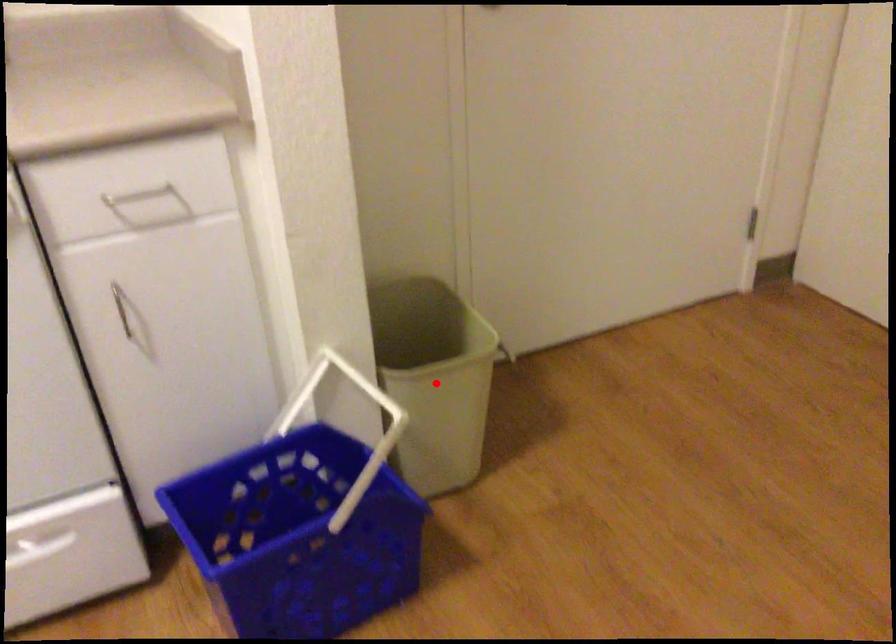
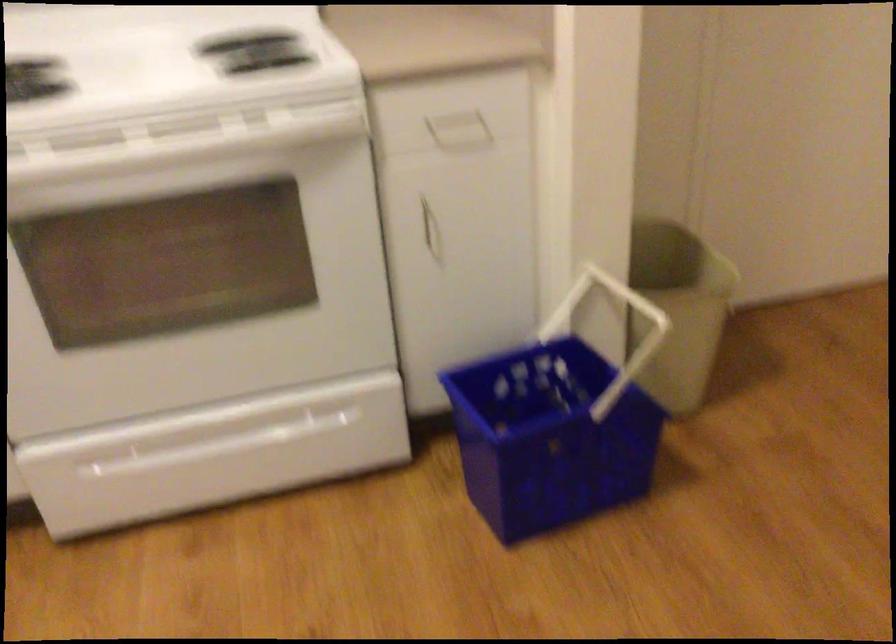
Question: I am providing you with two images of the same scene from different viewpoints. A red point is marked on the first image. Is the red point's position out of view in image 2?

Choices:
 (A) Yes
 (B) No

Answer: (B)